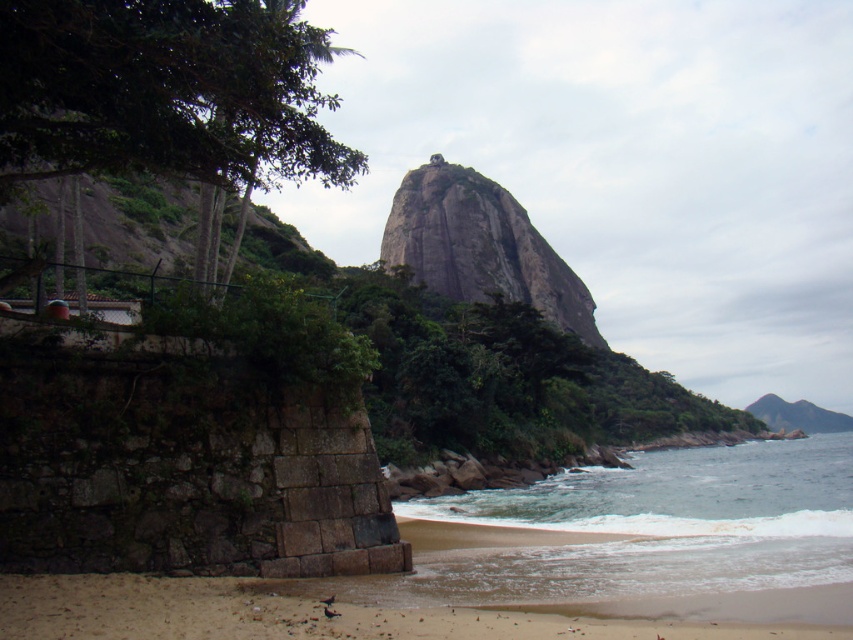
Question: Where is white sandy water at lower center located in relation to sandy beach at lower left in the image?

Choices:
 (A) below
 (B) above

Answer: (A)

Question: Is white sandy water at lower center thinner than gray rock at center?

Choices:
 (A) no
 (B) yes

Answer: (A)

Question: Which object is positioned farthest from the sandy beach at lower left?

Choices:
 (A) gray rock at center
 (B) white sandy water at lower center

Answer: (A)

Question: Based on their relative distances, which object is nearer to the sandy beach at lower left?

Choices:
 (A) gray rock at center
 (B) white sandy water at lower center

Answer: (B)

Question: Which object is closer to the camera taking this photo?

Choices:
 (A) gray rock at center
 (B) white sandy water at lower center

Answer: (B)

Question: Is sandy beach at lower left closer to camera compared to gray rock at center?

Choices:
 (A) yes
 (B) no

Answer: (A)